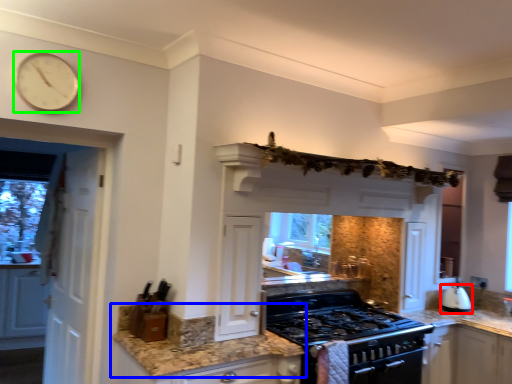
Question: Which object is the farthest from kitchen appliance (highlighted by a red box)? Choose among these: countertop (highlighted by a blue box) or clock (highlighted by a green box).

Choices:
 (A) countertop
 (B) clock

Answer: (B)